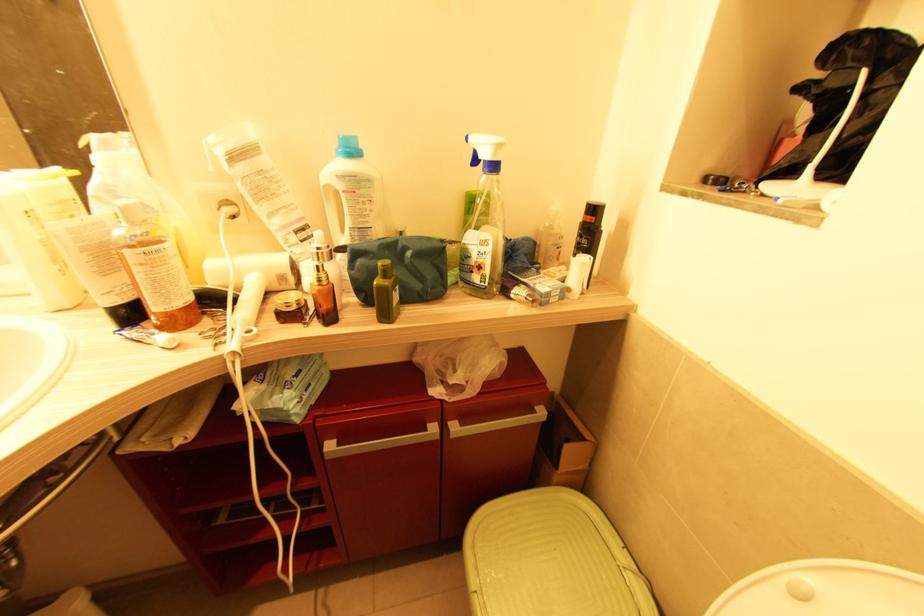
The width and height of the screenshot is (924, 616). What do you see at coordinates (348, 148) in the screenshot?
I see `the blue spray trigger` at bounding box center [348, 148].